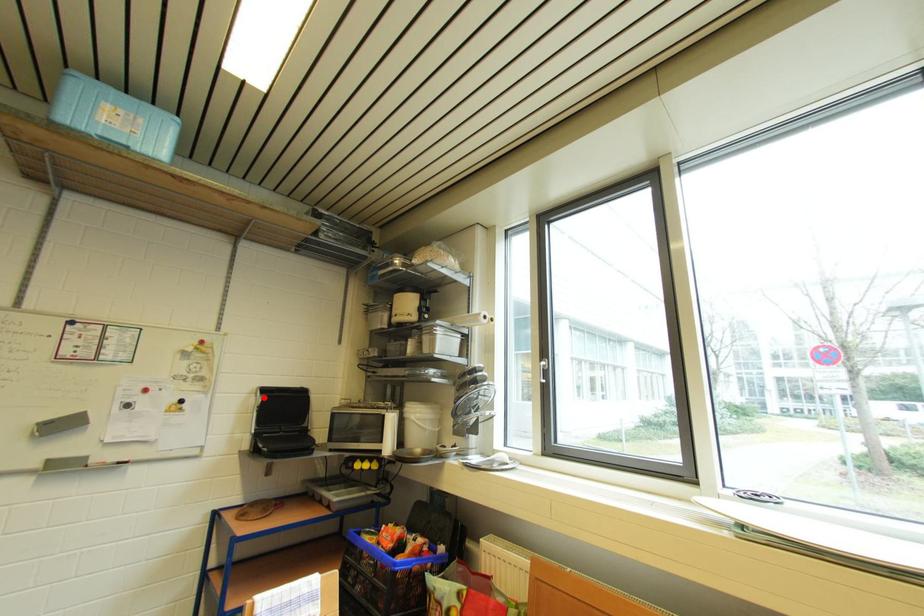
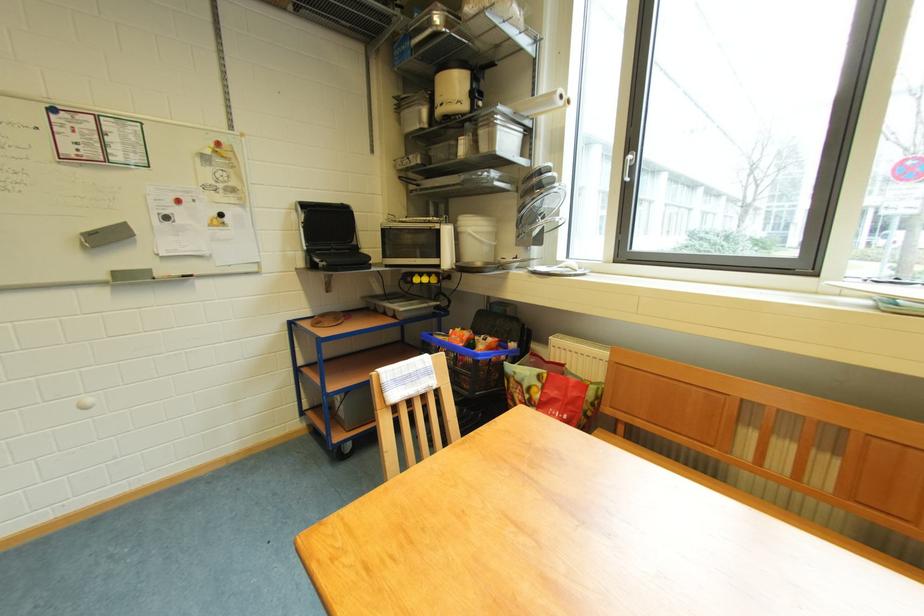
In the second image, find the point that corresponds to the highlighted location in the first image.

(305, 214)